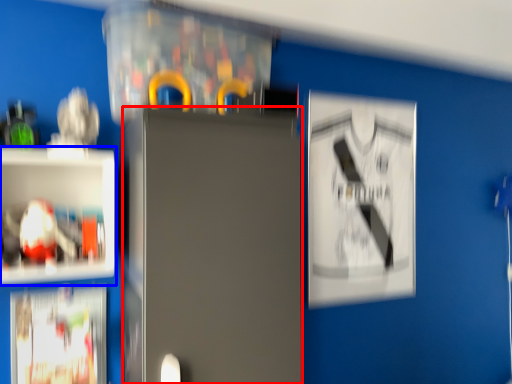
Question: Which point is further to the camera, fridge (highlighted by a red box) or shelf (highlighted by a blue box)?

Choices:
 (A) fridge
 (B) shelf

Answer: (B)